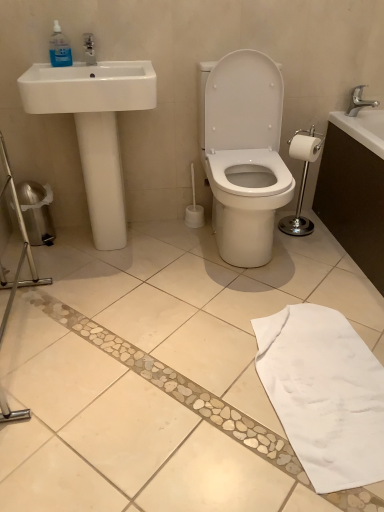
Find the location of a particular element. empty space that is ontop of white cotton bath towel at lower right is located at coordinates (321, 372).